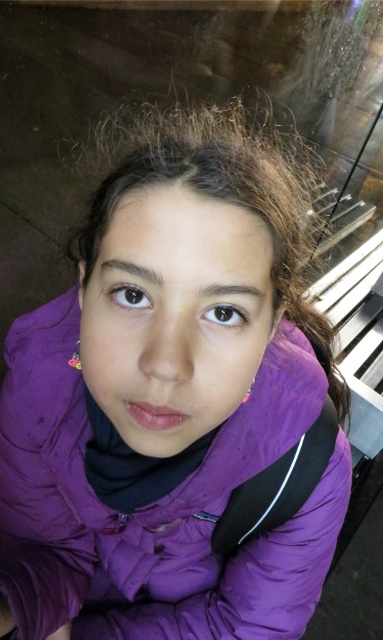
Question: Which of the following is the farthest from the observer?

Choices:
 (A) brown matte eye at upper center
 (B) brown glossy eye at center

Answer: (A)

Question: Does brown matte eye at upper center appear on the left side of brown glossy eye at center?

Choices:
 (A) yes
 (B) no

Answer: (A)

Question: Among these points, which one is nearest to the camera?

Choices:
 (A) (122, 305)
 (B) (242, 321)

Answer: (A)

Question: Does brown matte eye at upper center have a larger size compared to brown glossy eye at center?

Choices:
 (A) no
 (B) yes

Answer: (B)

Question: Does brown matte eye at upper center come in front of brown glossy eye at center?

Choices:
 (A) no
 (B) yes

Answer: (A)